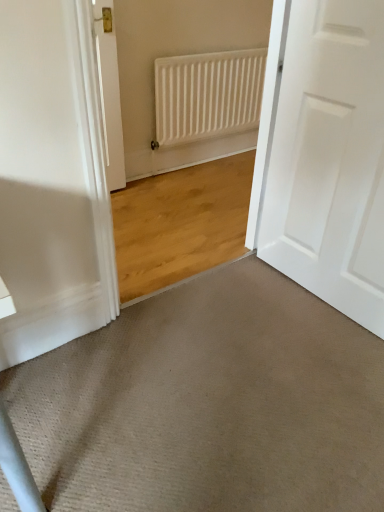
Find the location of `unoccupied area in front of white matte door at right`. unoccupied area in front of white matte door at right is located at coordinates (308, 361).